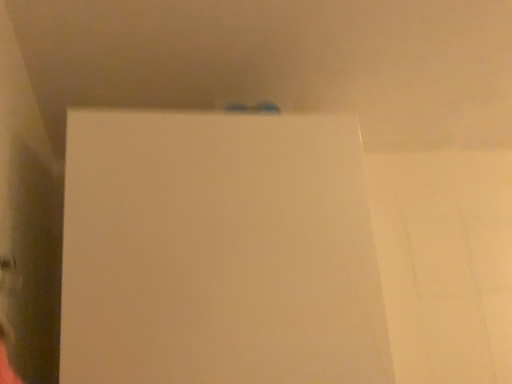
Locate an element on the screen. The height and width of the screenshot is (384, 512). white paper at center is located at coordinates (218, 252).

Describe the element at coordinates (218, 252) in the screenshot. I see `white paper at center` at that location.

Identify the location of white paper at center. The width and height of the screenshot is (512, 384). (218, 252).